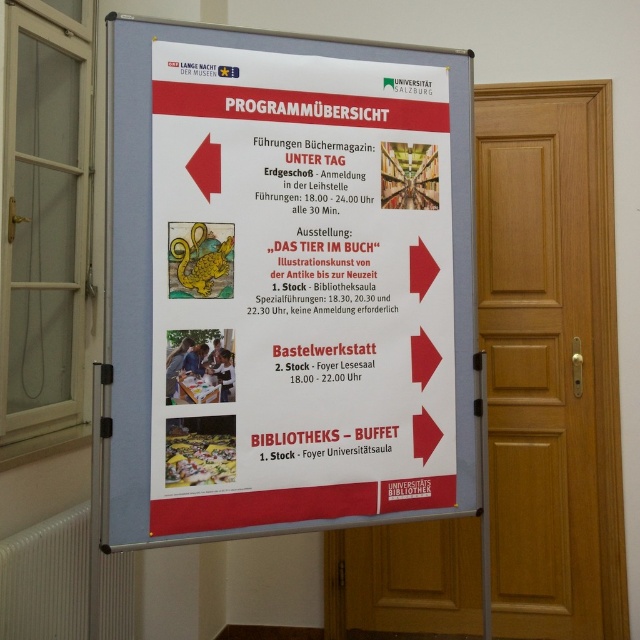
Question: Where is white paper poster at center located in relation to wooden door at right in the image?

Choices:
 (A) above
 (B) below

Answer: (A)

Question: Is white paper poster at center positioned at the back of wooden door at right?

Choices:
 (A) yes
 (B) no

Answer: (B)

Question: Which of the following is the farthest from the observer?

Choices:
 (A) white paper poster at center
 (B) wooden door at right

Answer: (B)

Question: Among these points, which one is nearest to the camera?

Choices:
 (A) (532, 186)
 (B) (253, 467)

Answer: (B)

Question: Is white paper poster at center above wooden door at right?

Choices:
 (A) no
 (B) yes

Answer: (B)

Question: Which point is farther to the camera?

Choices:
 (A) click(x=179, y=369)
 (B) click(x=580, y=493)

Answer: (B)